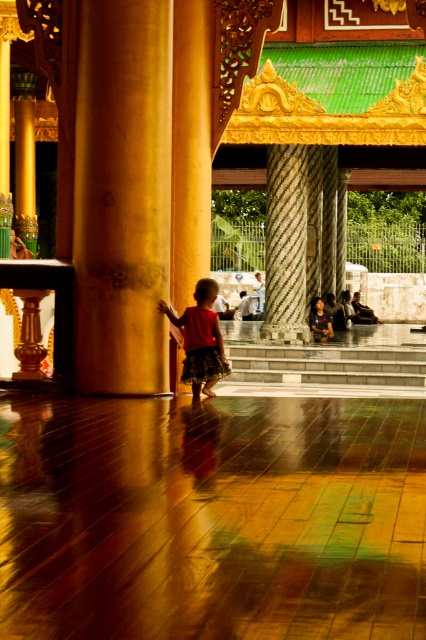
Does matte red dress at center have a greater width compared to red cotton skirt at center?

In fact, matte red dress at center might be narrower than red cotton skirt at center.

Does matte red dress at center have a larger size compared to red cotton skirt at center?

Actually, matte red dress at center might be smaller than red cotton skirt at center.

Locate an element on the screen. matte red dress at center is located at coordinates (201, 339).

Between gold polished pillar at center and matte red dress at center, which one has more height?

With more height is gold polished pillar at center.

Between point (100, 17) and point (210, 323), which one is positioned in front?

Point (100, 17)

Locate an element on the screen. The width and height of the screenshot is (426, 640). gold polished pillar at center is located at coordinates (121, 195).

Who is shorter, marble-patterned column at center or matte red dress at center?

With less height is matte red dress at center.

Is point (302, 296) closer to viewer compared to point (209, 305)?

No, it is not.

Is point (293, 186) positioned behind point (201, 328)?

Yes.

At what (x,y) coordinates should I click in order to perform the action: click on marble-patterned column at center. Please return your answer as a coordinate pair (x, y). This screenshot has height=640, width=426. Looking at the image, I should click on (285, 244).